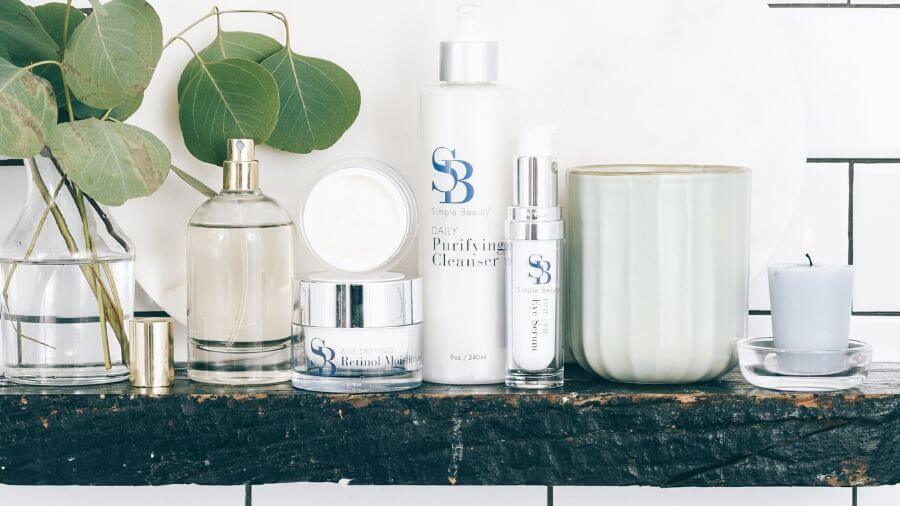
At what (x,y) coordinates should I click in order to perform the action: click on candle holder. Please return your answer as a coordinate pair (x, y). This screenshot has width=900, height=506. Looking at the image, I should click on (796, 363).